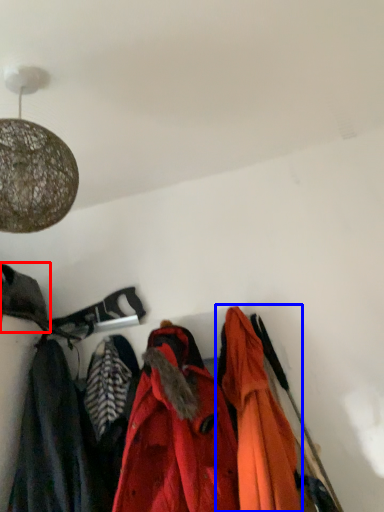
Question: Which object appears farthest to the camera in this image, cloak (highlighted by a red box) or jacket (highlighted by a blue box)?

Choices:
 (A) cloak
 (B) jacket

Answer: (A)